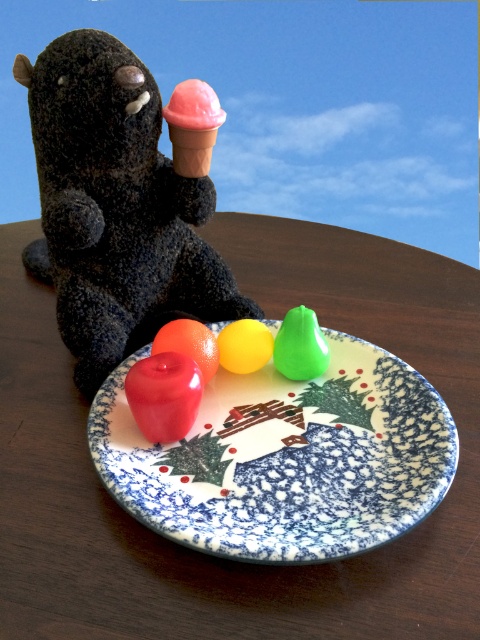
In the scene shown: You are trying to place a new toy between the fuzzy black stuffed animal at left and the pink matte ice cream cone at upper center. Based on their positions, which side of the ice cream cone should you place the new toy to ensure it stays between them?

The fuzzy black stuffed animal at left is to the left of the pink matte ice cream cone at upper center, so placing the new toy to the right side of the pink matte ice cream cone at upper center would keep it between them.